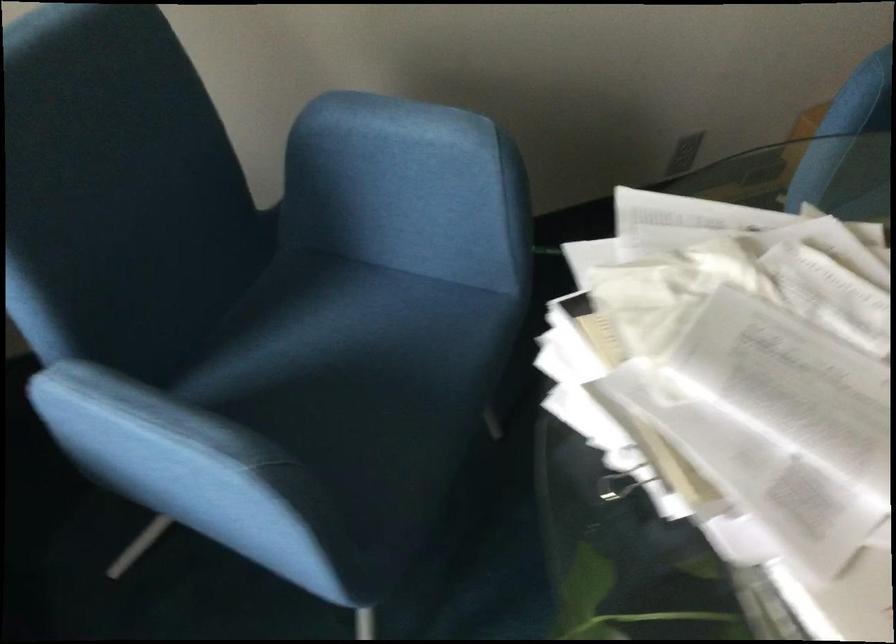
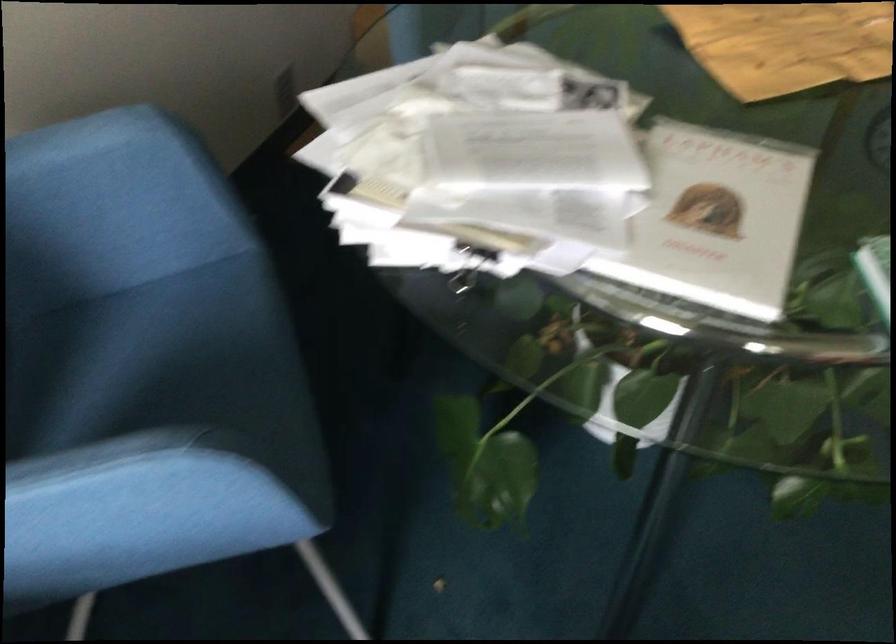
Find the pixel in the second image that matches point 435,153 in the first image.

(109, 162)